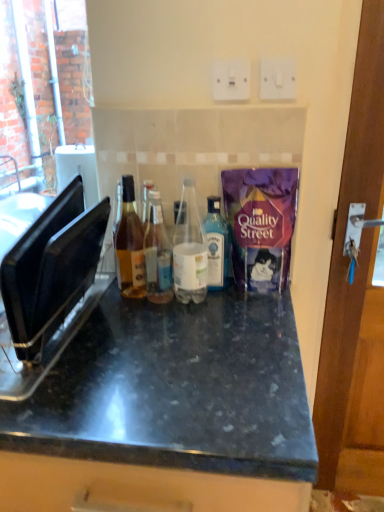
Locate an element on the screen. vacant space in front of translucent glass bottle at center, the second bottle in the left-to-right sequence is located at coordinates (153, 330).